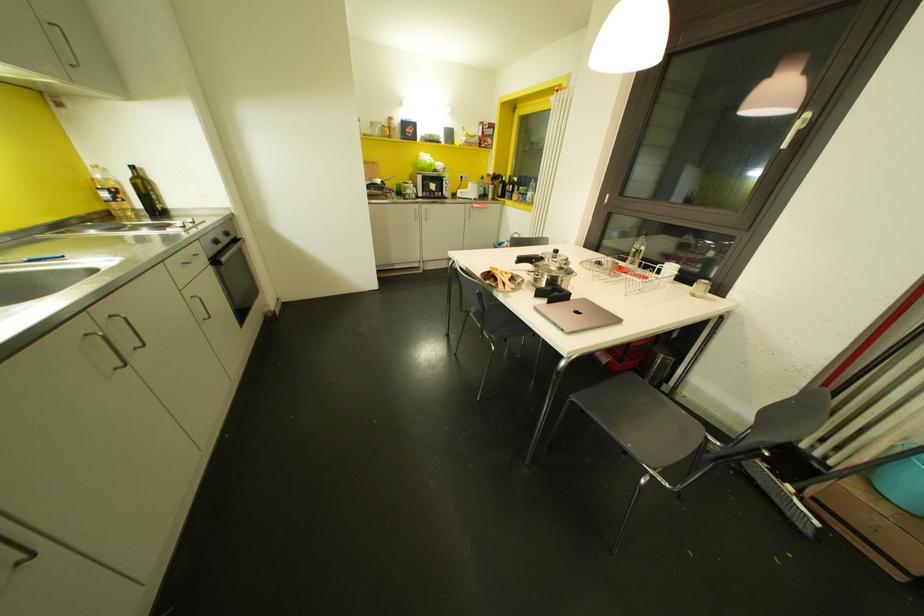
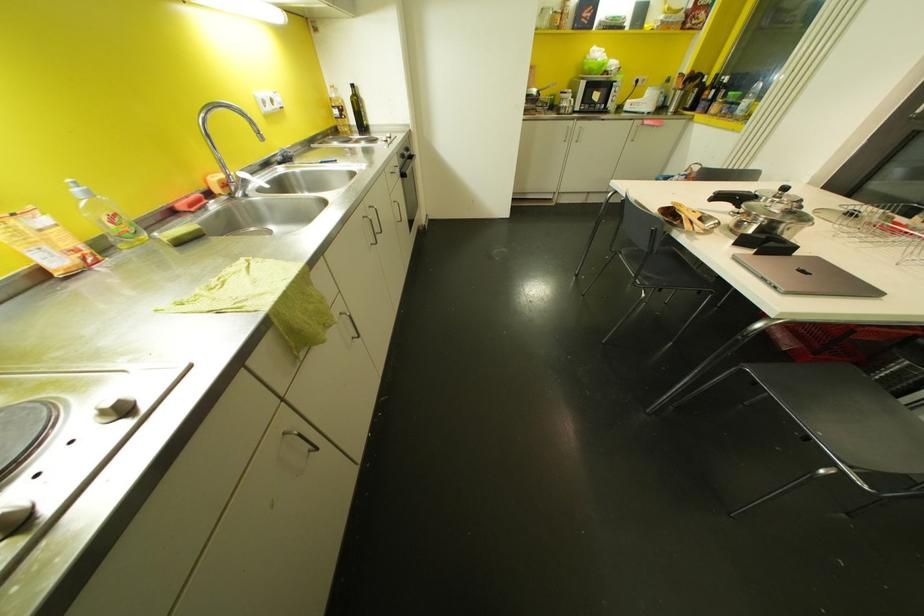
Locate, in the second image, the point that corresponds to [519,259] in the first image.

(718, 196)